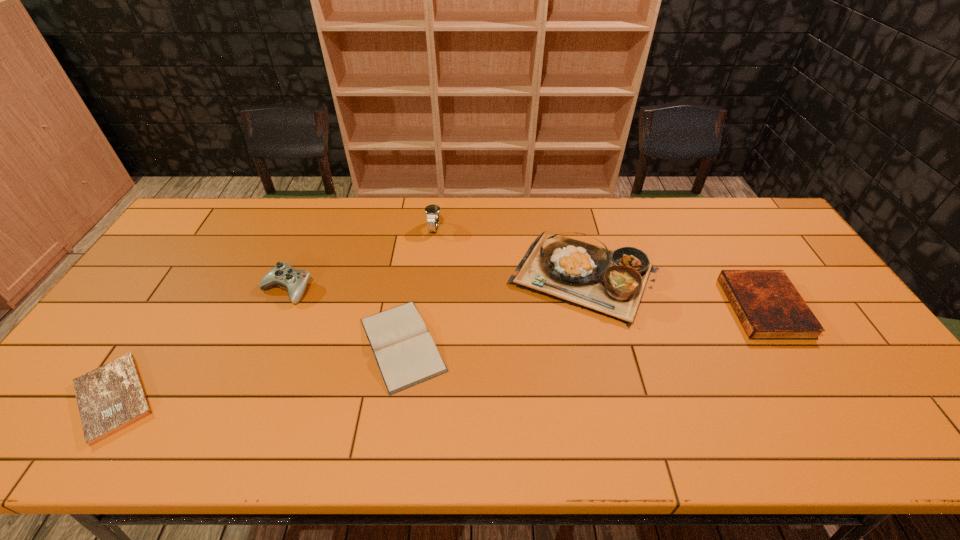
Find the location of a particular element. The width and height of the screenshot is (960, 540). vacant area that lies between the watch and the platter is located at coordinates click(510, 253).

This screenshot has height=540, width=960. I want to click on vacant area that lies between the fifth object from left to right and the tallest Bible, so click(674, 292).

This screenshot has height=540, width=960. Identify the location of vacant space that's between the leftmost Bible and the second shortest Bible. (x=258, y=370).

Locate an element on the screen. The width and height of the screenshot is (960, 540). free space between the fifth tallest object and the watch is located at coordinates (419, 286).

In order to click on empty location between the shortest object and the platter in this screenshot , I will do click(x=349, y=337).

Where is `unoccupied area between the second object from right to left and the watch`? This screenshot has height=540, width=960. unoccupied area between the second object from right to left and the watch is located at coordinates (510, 253).

The height and width of the screenshot is (540, 960). In order to click on unoccupied area between the fifth tallest object and the tallest Bible in this screenshot , I will do `click(583, 326)`.

Choose which object is the fourth nearest neighbor to the leftmost Bible. Please provide its 2D coordinates. Your answer should be formatted as a tuple, i.e. [(x, y)], where the tuple contains the x and y coordinates of a point satisfying the conditions above.

[(611, 283)]

Select which object is the fifth closest to the watch. Please provide its 2D coordinates. Your answer should be formatted as a tuple, i.e. [(x, y)], where the tuple contains the x and y coordinates of a point satisfying the conditions above.

[(769, 307)]

Point out which Bible is positioned as the nearest to the second object from left to right. Please provide its 2D coordinates. Your answer should be formatted as a tuple, i.e. [(x, y)], where the tuple contains the x and y coordinates of a point satisfying the conditions above.

[(405, 352)]